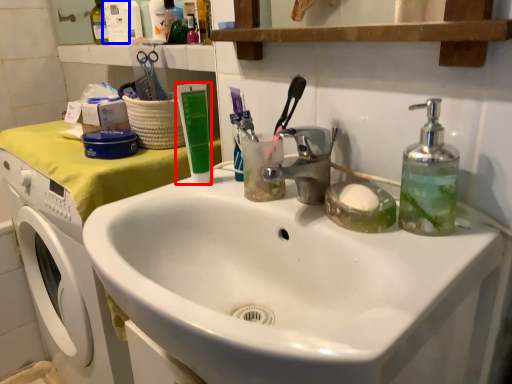
Question: Which object is further to the camera taking this photo, toothpaste (highlighted by a red box) or toiletry (highlighted by a blue box)?

Choices:
 (A) toothpaste
 (B) toiletry

Answer: (B)